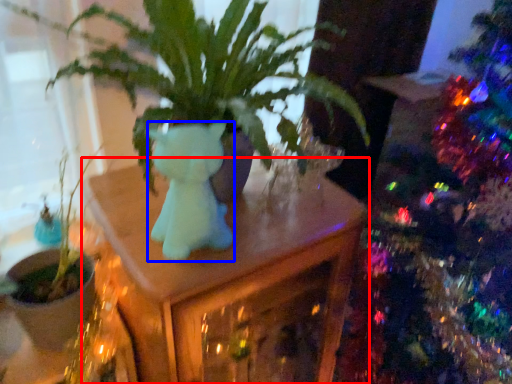
Question: Which of the following is the farthest to the observer, table (highlighted by a red box) or animal (highlighted by a blue box)?

Choices:
 (A) table
 (B) animal

Answer: (A)